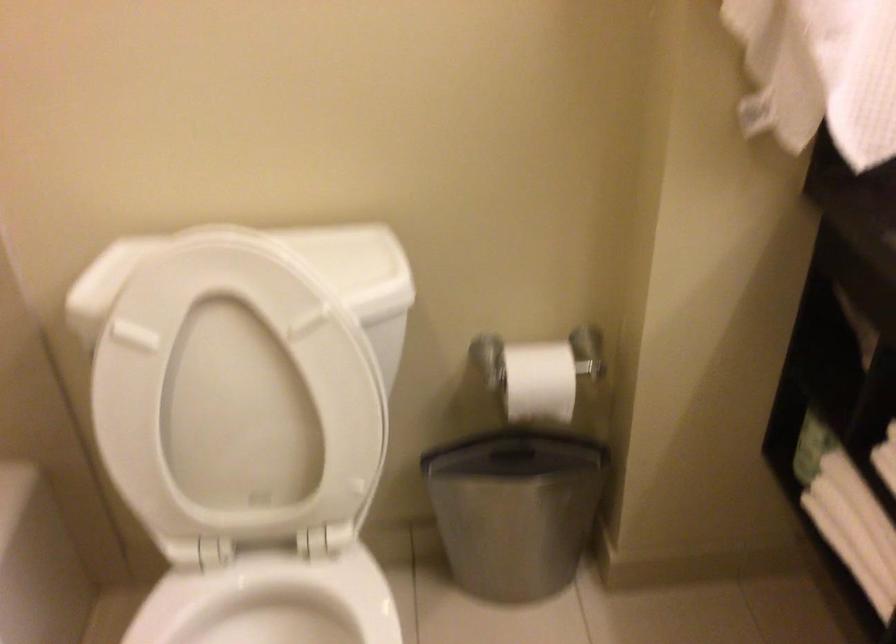
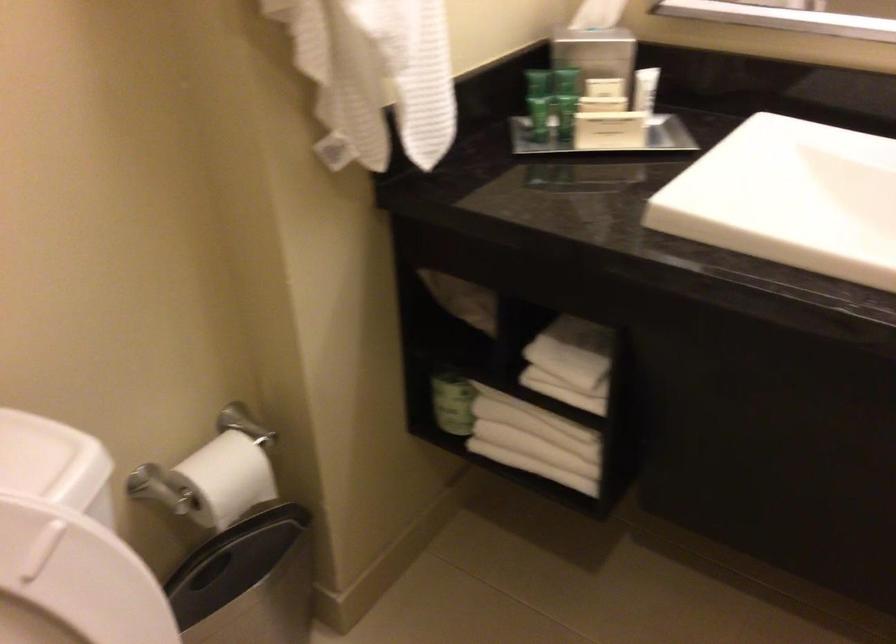
Question: I am providing you with two images of the same scene from different viewpoints. Please identify which objects are invisible in image2.

Choices:
 (A) small paper box
 (B) small green tube
 (C) black trash can lid
 (D) none of these

Answer: (D)